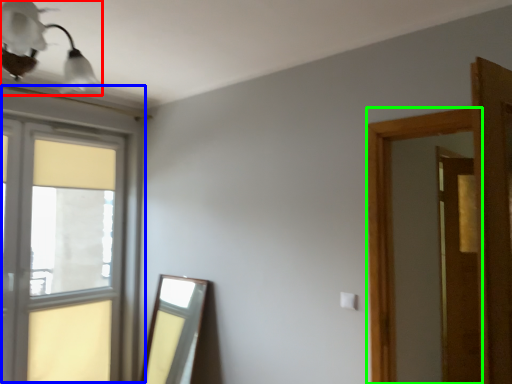
Question: Based on their relative distances, which object is nearer to light fixture (highlighted by a red box)? Choose from window (highlighted by a blue box) and window frame (highlighted by a green box).

Choices:
 (A) window
 (B) window frame

Answer: (A)